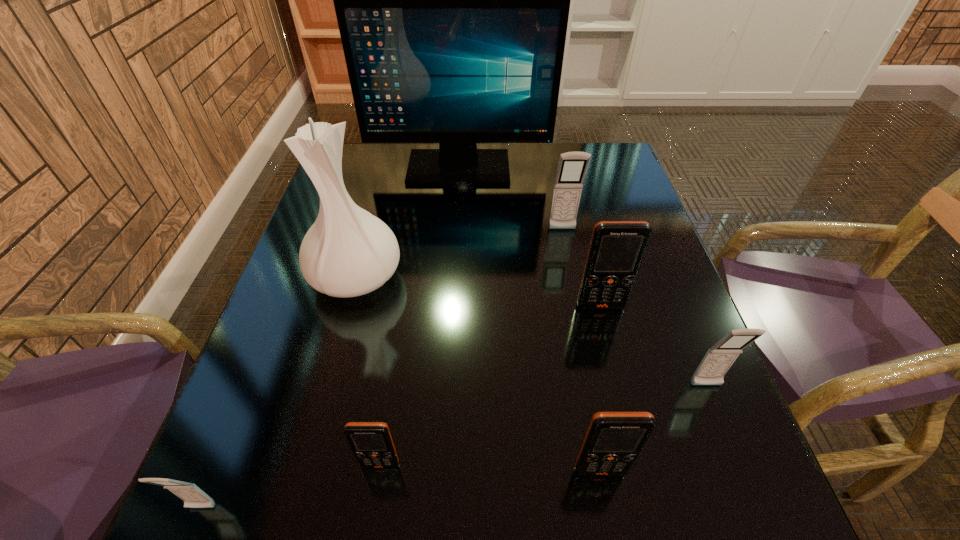
Locate an element on the screen. Image resolution: width=960 pixels, height=540 pixels. the tallest object is located at coordinates (452, 0).

This screenshot has width=960, height=540. Find the location of `the farthest object`. the farthest object is located at coordinates (452, 0).

I want to click on the second tallest object, so click(x=348, y=252).

The image size is (960, 540). Identify the location of white vase. (348, 252).

Find the location of `the farthest cellular telephone`. the farthest cellular telephone is located at coordinates (572, 167).

You are a GUI agent. You are given a task and a screenshot of the screen. Output one action in this format:
    pyautogui.click(x=<x>, y=<y>)
    Task: Click on the seventh nearest object
    The image size is (960, 540).
    Given the screenshot: What is the action you would take?
    pyautogui.click(x=572, y=167)

Image resolution: width=960 pixels, height=540 pixels. I want to click on the biggest orange cellular telephone, so click(x=617, y=248).

Where is `the second farthest cellular telephone`? This screenshot has width=960, height=540. the second farthest cellular telephone is located at coordinates (617, 248).

At what (x,y) coordinates should I click in order to perform the action: click on the rightmost gray cellular telephone. Please return your answer as a coordinate pair (x, y). Looking at the image, I should click on (719, 358).

Identify the location of the second biggest gray cellular telephone. The width and height of the screenshot is (960, 540). (719, 358).